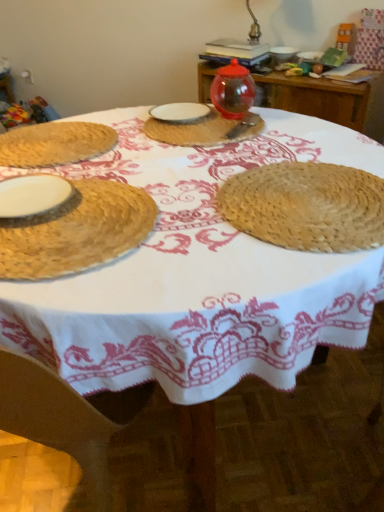
Image resolution: width=384 pixels, height=512 pixels. Describe the element at coordinates (327, 100) in the screenshot. I see `transparent glass jar at upper center, placed as the 2th table when sorted from left to right` at that location.

Measure the distance between matte wicker placemat at center and camera.

matte wicker placemat at center and camera are 3.73 feet apart.

Identify the location of woven straw placemat at left, the second table viewed from the top. This screenshot has height=512, width=384. (54, 143).

Locate an element on the screen. transparent glass jar at upper center, acting as the first tableware starting from the top is located at coordinates (283, 53).

This screenshot has height=512, width=384. What are the coordinates of `white ceramic plate at center, the 2th tableware viewed from the back` in the screenshot? It's located at coord(180,113).

Where is `transparent glass jar at upper center, arranged as the first table when viewed from the right`? The width and height of the screenshot is (384, 512). transparent glass jar at upper center, arranged as the first table when viewed from the right is located at coordinates click(327, 100).

Considering the positions of points (62, 259) and (236, 106), is point (62, 259) closer to camera compared to point (236, 106)?

Yes.

How distant is natural straw placemat at left, which is the 5th tableware in back-to-front order, from transparent glass jar at upper center, which appears as the second tableware when viewed from the top?

natural straw placemat at left, which is the 5th tableware in back-to-front order, is 28.93 inches away from transparent glass jar at upper center, which appears as the second tableware when viewed from the top.

Is natural straw placemat at left, acting as the first tableware starting from the front, next to transparent glass jar at upper center, the 4th tableware ordered from the bottom, and touching it?

There is a gap between natural straw placemat at left, acting as the first tableware starting from the front, and transparent glass jar at upper center, the 4th tableware ordered from the bottom.

Is natural straw placemat at left, which is counted as the fifth tableware, starting from the top, thinner than transparent glass jar at upper center, which appears as the second tableware when viewed from the top?

In fact, natural straw placemat at left, which is counted as the fifth tableware, starting from the top, might be wider than transparent glass jar at upper center, which appears as the second tableware when viewed from the top.

Looking at this image, which is in front, transparent glass jar at upper center, the 4th tableware ordered from the bottom, or transparent glass jar at upper center, which is counted as the 5th tableware, starting from the bottom?

transparent glass jar at upper center, the 4th tableware ordered from the bottom, is closer to the camera.

Does transparent glass jar at upper center, which appears as the second tableware when viewed from the top, contain transparent glass jar at upper center, which is counted as the 5th tableware, starting from the bottom?

No, transparent glass jar at upper center, which appears as the second tableware when viewed from the top, does not contain transparent glass jar at upper center, which is counted as the 5th tableware, starting from the bottom.

From the picture: From the image's perspective, which one is positioned lower, transparent glass jar at upper center, which appears as the second tableware when viewed from the top, or transparent glass jar at upper center, which is the fifth tableware from front to back?

transparent glass jar at upper center, which appears as the second tableware when viewed from the top.

Is transparent glass jar at upper center, which is the third tableware from front to back, beside transparent glass jar at upper center, acting as the first tableware starting from the top?

No, transparent glass jar at upper center, which is the third tableware from front to back, is not making contact with transparent glass jar at upper center, acting as the first tableware starting from the top.

In the image, is natural straw placemat at left, which is the 1th tableware in bottom-to-top order, on the left side or the right side of transparent glass jar at upper center, placed as the 1th table when sorted from top to bottom?

natural straw placemat at left, which is the 1th tableware in bottom-to-top order, is to the left of transparent glass jar at upper center, placed as the 1th table when sorted from top to bottom.

From the image's perspective, is natural straw placemat at left, acting as the first tableware starting from the front, below transparent glass jar at upper center, placed as the 2th table when sorted from left to right?

Indeed, from the image's perspective, natural straw placemat at left, acting as the first tableware starting from the front, is shown beneath transparent glass jar at upper center, placed as the 2th table when sorted from left to right.

Does natural straw placemat at left, acting as the first tableware starting from the front, come behind transparent glass jar at upper center, arranged as the 1th table when viewed from the back?

No, it is in front of transparent glass jar at upper center, arranged as the 1th table when viewed from the back.

How many degrees apart are the facing directions of natural straw placemat at left, which is the 1th tableware in bottom-to-top order, and transparent glass jar at upper center, arranged as the first table when viewed from the right?

There is a 83.5-degree angle between the facing directions of natural straw placemat at left, which is the 1th tableware in bottom-to-top order, and transparent glass jar at upper center, arranged as the first table when viewed from the right.

Which object is positioned more to the left, natural straw placemat at left, acting as the first tableware starting from the front, or white matte plate at left, the second tableware when ordered from bottom to top?

white matte plate at left, the second tableware when ordered from bottom to top.

Can white matte plate at left, the second tableware when ordered from bottom to top, be found inside natural straw placemat at left, which is counted as the fifth tableware, starting from the top?

Yes, natural straw placemat at left, which is counted as the fifth tableware, starting from the top, is surrounding white matte plate at left, the second tableware when ordered from bottom to top.

Is point (95, 218) positioned behind point (3, 184)?

That is False.

From a real-world perspective, who is located lower, natural straw placemat at left, which is the 5th tableware in back-to-front order, or white matte plate at left, which is the 4th tableware in back-to-front order?

natural straw placemat at left, which is the 5th tableware in back-to-front order, is physically lower.

Choose the correct answer: Is natural straw placemat at left, which is the 5th tableware in back-to-front order, inside transparent glass jar at upper center, which is counted as the 5th tableware, starting from the bottom, or outside it?

natural straw placemat at left, which is the 5th tableware in back-to-front order, is not enclosed by transparent glass jar at upper center, which is counted as the 5th tableware, starting from the bottom.

You are a GUI agent. You are given a task and a screenshot of the screen. Output one action in this format:
    pyautogui.click(x=<x>, y=<y>)
    Task: Click on the tableware that is the 2nd object above the transparent glass jar at upper center, which is the 1th tableware in back-to-front order (from a real-world perspective)
    This screenshot has width=384, height=512.
    Given the screenshot: What is the action you would take?
    pyautogui.click(x=76, y=231)

Is natural straw placemat at left, acting as the first tableware starting from the front, shorter than transparent glass jar at upper center, acting as the first tableware starting from the top?

Correct, natural straw placemat at left, acting as the first tableware starting from the front, is not as tall as transparent glass jar at upper center, acting as the first tableware starting from the top.

Is transparent glass jar at upper center, acting as the first tableware starting from the top, facing away from white ceramic plate at center, the 2th tableware viewed from the back?

No, transparent glass jar at upper center, acting as the first tableware starting from the top, is not facing away from white ceramic plate at center, the 2th tableware viewed from the back.

Considering the relative sizes of transparent glass jar at upper center, acting as the first tableware starting from the top, and white ceramic plate at center, positioned as the third tableware in top-to-bottom order, in the image provided, is transparent glass jar at upper center, acting as the first tableware starting from the top, thinner than white ceramic plate at center, positioned as the third tableware in top-to-bottom order,?

Correct, the width of transparent glass jar at upper center, acting as the first tableware starting from the top, is less than that of white ceramic plate at center, positioned as the third tableware in top-to-bottom order.

Which object is closer to the camera, transparent glass jar at upper center, which is the fifth tableware from front to back, or white ceramic plate at center, the 2th tableware viewed from the back?

white ceramic plate at center, the 2th tableware viewed from the back, is more forward.

From the image's perspective, is transparent glass jar at upper center, which is counted as the 5th tableware, starting from the bottom, located above or below white matte plate at left, the second tableware when ordered from bottom to top?

Clearly, from the image's perspective, transparent glass jar at upper center, which is counted as the 5th tableware, starting from the bottom, is above white matte plate at left, the second tableware when ordered from bottom to top.

Is transparent glass jar at upper center, which is the fifth tableware from front to back, positioned with its back to white matte plate at left, which ranks as the 2th tableware in front-to-back order?

No, white matte plate at left, which ranks as the 2th tableware in front-to-back order, is not at the back of transparent glass jar at upper center, which is the fifth tableware from front to back.

Between transparent glass jar at upper center, which is the fifth tableware from front to back, and white matte plate at left, which ranks as the 2th tableware in front-to-back order, which one has less height?

With less height is white matte plate at left, which ranks as the 2th tableware in front-to-back order.

From a real-world perspective, which is physically below, transparent glass jar at upper center, which is the 1th tableware in back-to-front order, or white matte plate at left, positioned as the fourth tableware in top-to-bottom order?

In real-world perspective, transparent glass jar at upper center, which is the 1th tableware in back-to-front order, is lower.

Locate an element on the screen. The height and width of the screenshot is (512, 384). the 2nd tableware counting from the right of the natural straw placemat at left, which is the 1th tableware in bottom-to-top order is located at coordinates (233, 90).

You are a GUI agent. You are given a task and a screenshot of the screen. Output one action in this format:
    pyautogui.click(x=<x>, y=<y>)
    Task: Click on the tableware that is the 4th one below the transparent glass jar at upper center, which is the third tableware from front to back (from a real-world perspective)
    
    Given the screenshot: What is the action you would take?
    pyautogui.click(x=283, y=53)

Which object lies further to the anchor point transparent glass jar at upper center, arranged as the first table when viewed from the right, transparent glass jar at upper center, the 4th tableware ordered from the bottom, or matte wicker placemat at center?

matte wicker placemat at center.

Estimate the real-world distances between objects in this image. Which object is closer to white matte plate at left, the second tableware when ordered from bottom to top, natural straw placemat at left, which is the 1th tableware in bottom-to-top order, or matte wicker placemat at center?

natural straw placemat at left, which is the 1th tableware in bottom-to-top order.

Looking at the image, which one is located further to matte wicker placemat at center, transparent glass jar at upper center, which is counted as the 5th tableware, starting from the bottom, or white ceramic plate at center, acting as the third tableware starting from the bottom?

Among the two, transparent glass jar at upper center, which is counted as the 5th tableware, starting from the bottom, is located further to matte wicker placemat at center.

Looking at the image, which one is located further to natural straw placemat at center, woven straw placemat at left, placed as the second table when sorted from back to front, or matte wicker placemat at center?

The object further to natural straw placemat at center is woven straw placemat at left, placed as the second table when sorted from back to front.

Considering their positions, is white matte plate at left, positioned as the fourth tableware in top-to-bottom order, positioned closer to natural straw placemat at center than transparent glass jar at upper center, which is counted as the 5th tableware, starting from the bottom?

The object closer to natural straw placemat at center is white matte plate at left, positioned as the fourth tableware in top-to-bottom order.

Looking at this image, considering their positions, is matte wicker placemat at center positioned further to white matte plate at left, which is the 4th tableware in back-to-front order, than woven straw placemat at left, placed as the second table when sorted from back to front?

matte wicker placemat at center is further to white matte plate at left, which is the 4th tableware in back-to-front order.

Based on their spatial positions, is natural straw placemat at center or woven straw placemat at left, the second table viewed from the top, further from matte wicker placemat at center?

natural straw placemat at center.

Based on their spatial positions, is white matte plate at left, which ranks as the 2th tableware in front-to-back order, or woven straw placemat at left, which is the second table from right to left, further from natural straw placemat at center?

woven straw placemat at left, which is the second table from right to left, is further to natural straw placemat at center.

This screenshot has width=384, height=512. Find the location of `platter between woven straw placemat at left, which ranks as the 1th table in left-to-right order, and natural straw placemat at center from left to right`. platter between woven straw placemat at left, which ranks as the 1th table in left-to-right order, and natural straw placemat at center from left to right is located at coordinates 204,130.

The image size is (384, 512). I want to click on platter located between natural straw placemat at left, which is the 5th tableware in back-to-front order, and transparent glass jar at upper center, placed as the 1th table when sorted from top to bottom, in the depth direction, so click(204, 130).

At what (x,y) coordinates should I click in order to perform the action: click on straw hat positioned between natural straw placemat at left, which is the 5th tableware in back-to-front order, and transparent glass jar at upper center, which is the third tableware from front to back, from near to far. Please return your answer as a coordinate pair (x, y). The image size is (384, 512). Looking at the image, I should click on (306, 206).

You are a GUI agent. You are given a task and a screenshot of the screen. Output one action in this format:
    pyautogui.click(x=<x>, y=<y>)
    Task: Click on the tableware located between natural straw placemat at left, which is the 1th tableware in bottom-to-top order, and transparent glass jar at upper center, the 3th tableware when ordered from back to front, in the depth direction
    This screenshot has height=512, width=384.
    Given the screenshot: What is the action you would take?
    pyautogui.click(x=33, y=195)